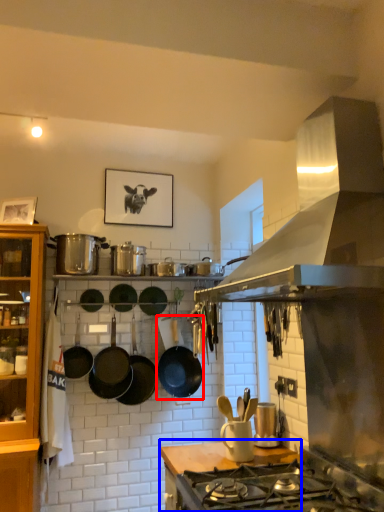
Question: Which point is closer to the camera, wok (highlighted by a red box) or countertop (highlighted by a blue box)?

Choices:
 (A) wok
 (B) countertop

Answer: (B)